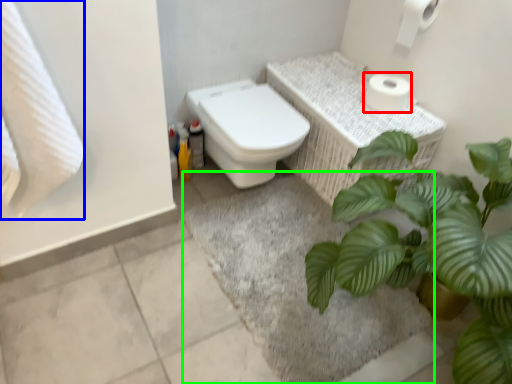
Question: Considering the real-world distances, which object is closest to toilet paper (highlighted by a red box)? bath towel (highlighted by a blue box) or bath mat (highlighted by a green box).

Choices:
 (A) bath towel
 (B) bath mat

Answer: (B)